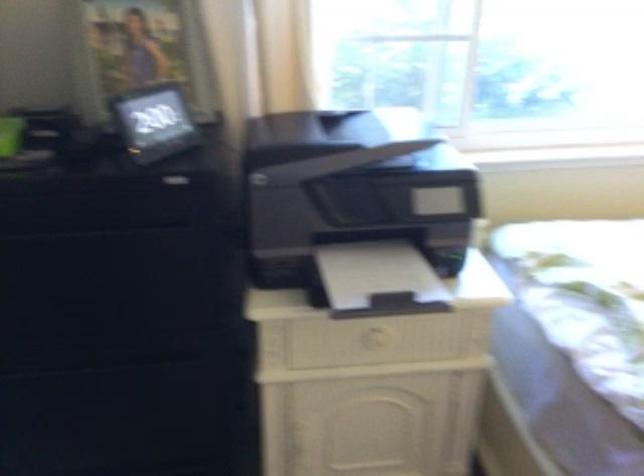
The height and width of the screenshot is (476, 644). I want to click on digital clock, so click(154, 122).